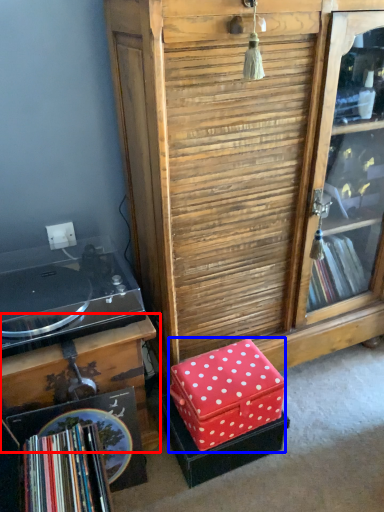
Question: Which object appears closest to the camera in this image, table (highlighted by a red box) or storage box (highlighted by a blue box)?

Choices:
 (A) table
 (B) storage box

Answer: (A)